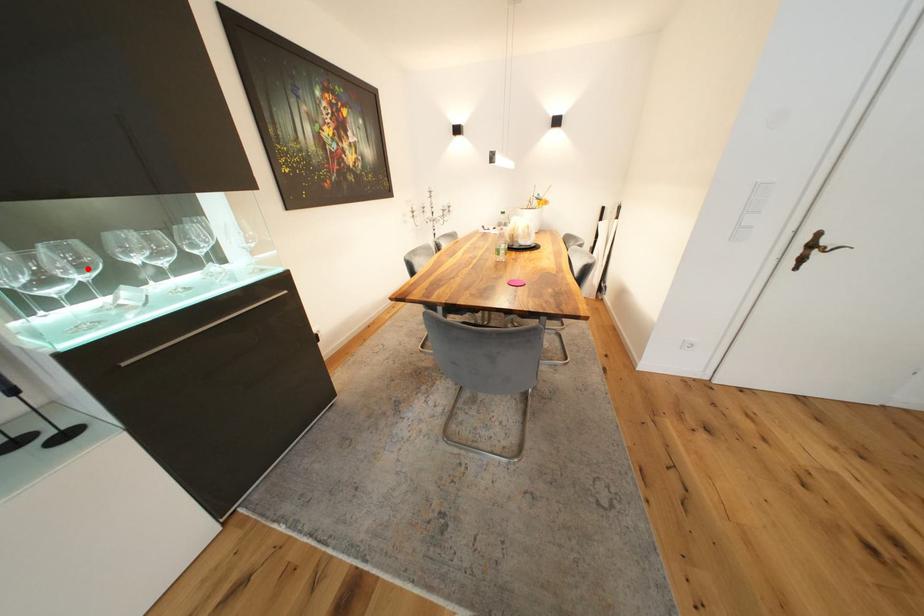
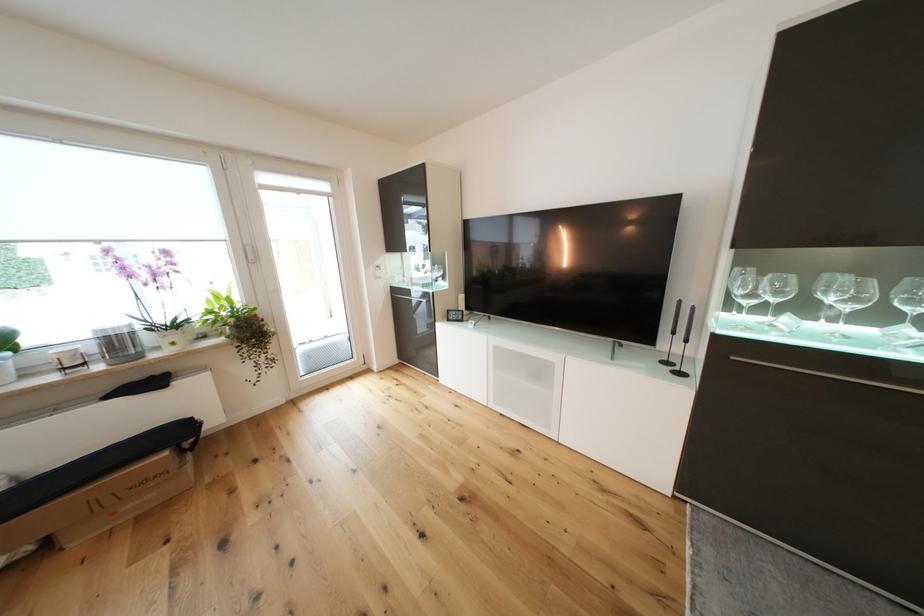
Find the pixel in the second image that matches the highlighted location in the first image.

(784, 294)